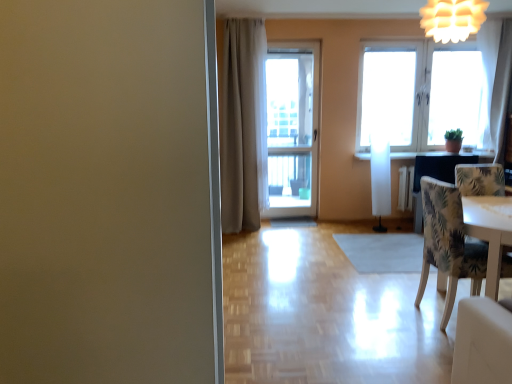
Question: Do you think white sheer curtain at upper right, which ranks as the 2th curtain in left-to-right order, is within white glass window at upper right, or outside of it?

Choices:
 (A) inside
 (B) outside

Answer: (B)

Question: Looking at their shapes, would you say white sheer curtain at upper right, which ranks as the 2th curtain in left-to-right order, is wider or thinner than white glass window at upper right?

Choices:
 (A) thin
 (B) wide

Answer: (B)

Question: Estimate the real-world distances between objects in this image. Which object is closer to the white glass door at center?

Choices:
 (A) patterned fabric chair at right
 (B) white paper lantern at upper right
 (C) white glass window at upper right
 (D) beige fabric curtain at center, arranged as the first curtain when viewed from the left
 (E) white sheer curtain at upper right, which ranks as the 2th curtain in left-to-right order

Answer: (D)

Question: Estimate the real-world distances between objects in this image. Which object is closer to the white sheer curtain at upper right, the 1th curtain in the right-to-left sequence?

Choices:
 (A) white glass door at center
 (B) white paper lantern at upper right
 (C) patterned fabric chair at right
 (D) beige fabric curtain at center, arranged as the first curtain when viewed from the left
 (E) white glass window at upper right

Answer: (E)